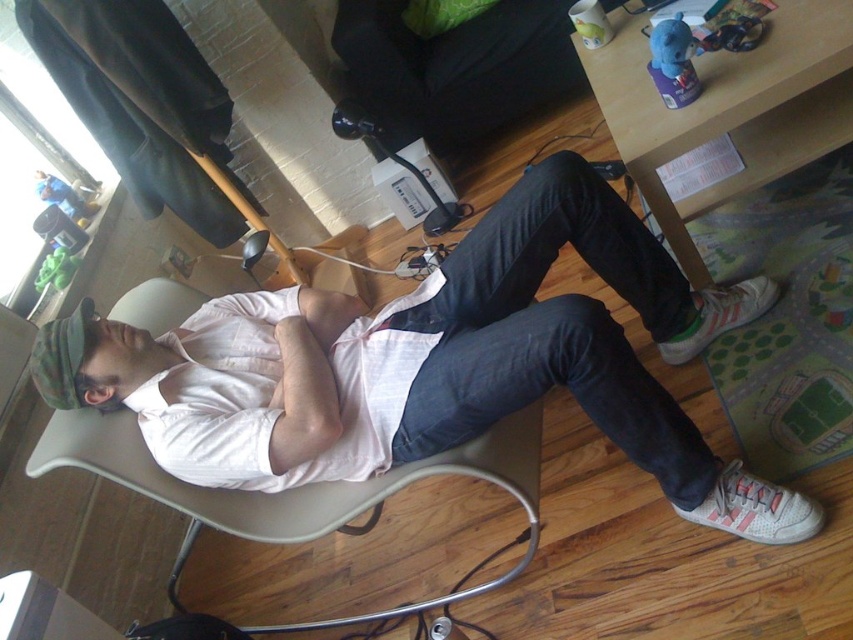
Which of these two, white cotton shirt at center or camouflage fabric cap at upper left, stands taller?

With more height is white cotton shirt at center.

In the scene shown: Does white cotton shirt at center have a lesser height compared to camouflage fabric cap at upper left?

In fact, white cotton shirt at center may be taller than camouflage fabric cap at upper left.

Is point (518, 259) in front of point (109, 384)?

No, it is behind (109, 384).

Locate an element on the screen. This screenshot has height=640, width=853. white cotton shirt at center is located at coordinates (433, 364).

From the picture: Is white cotton shirt at center bigger than wooden table at lower right?

Yes.

Can you confirm if white cotton shirt at center is thinner than wooden table at lower right?

No.

Is point (376, 324) positioned in front of point (821, 88)?

Yes, point (376, 324) is closer to viewer.

Image resolution: width=853 pixels, height=640 pixels. I want to click on white cotton shirt at center, so click(433, 364).

How much distance is there between white plastic swivel chair at center and camouflage fabric cap at upper left?

white plastic swivel chair at center is 8.90 inches away from camouflage fabric cap at upper left.

In the scene shown: Which is more to the left, white plastic swivel chair at center or camouflage fabric cap at upper left?

From the viewer's perspective, camouflage fabric cap at upper left appears more on the left side.

What do you see at coordinates (296, 492) in the screenshot? I see `white plastic swivel chair at center` at bounding box center [296, 492].

The height and width of the screenshot is (640, 853). What are the coordinates of `white plastic swivel chair at center` in the screenshot? It's located at (296, 492).